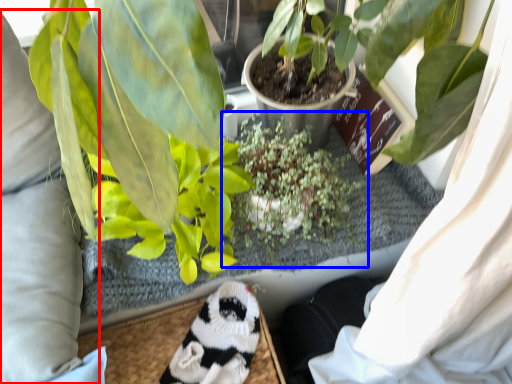
Question: Which object is closer to the camera taking this photo, clothing (highlighted by a red box) or houseplant (highlighted by a blue box)?

Choices:
 (A) clothing
 (B) houseplant

Answer: (A)